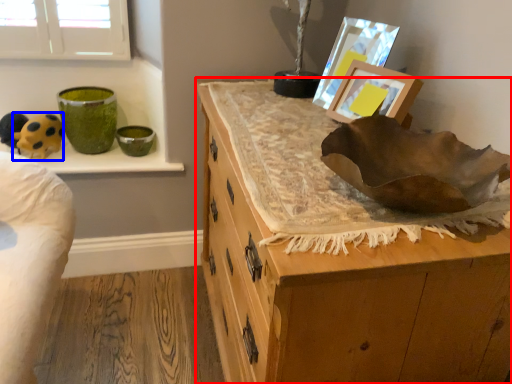
Question: Which point is further to the camera, chest of drawers (highlighted by a red box) or animal (highlighted by a blue box)?

Choices:
 (A) chest of drawers
 (B) animal

Answer: (B)